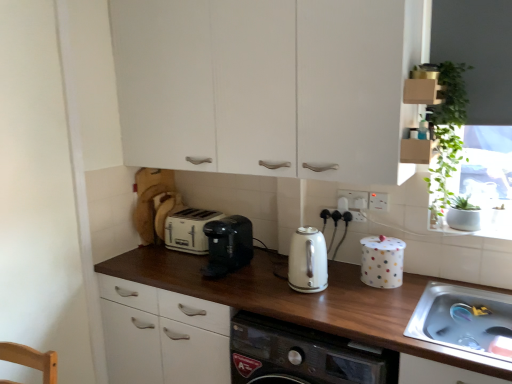
At what (x,y) coordinates should I click in order to perform the action: click on free spot in front of black plastic coffee maker at center, the 2th kitchen appliance when ordered from right to left. Please return your answer as a coordinate pair (x, y). The image size is (512, 384). Looking at the image, I should click on (234, 287).